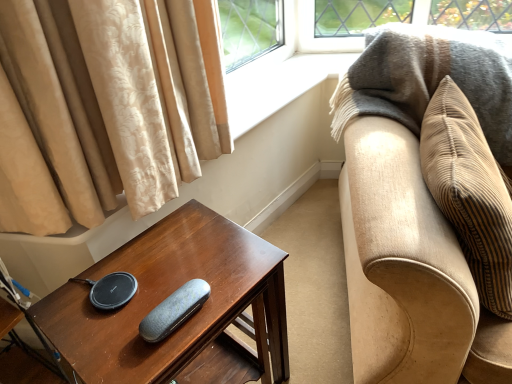
Find the location of a particular element. vacant area located to the right-hand side of textured gray case at center is located at coordinates pos(234,288).